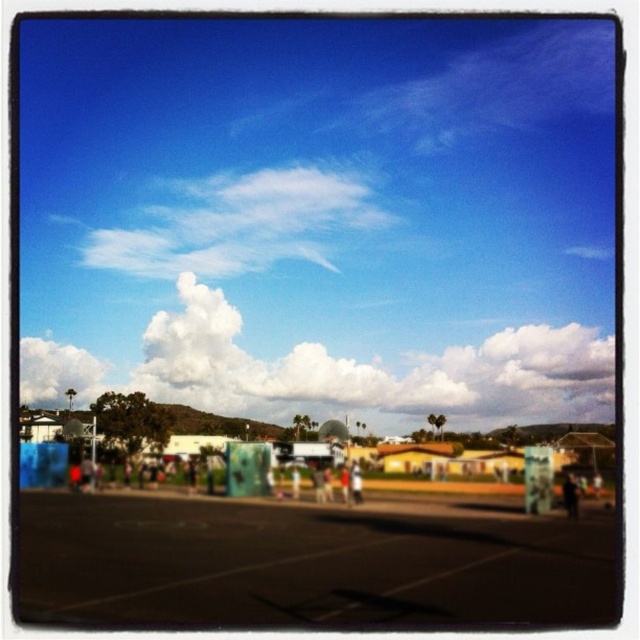
Question: Can you confirm if black asphalt parking lot at lower left is positioned above white fluffy cloud at upper center?

Choices:
 (A) yes
 (B) no

Answer: (B)

Question: Is black asphalt parking lot at lower left positioned before white fluffy cloud at center?

Choices:
 (A) yes
 (B) no

Answer: (A)

Question: In this image, where is black asphalt parking lot at lower left located relative to white fluffy cloud at upper center?

Choices:
 (A) left
 (B) right

Answer: (B)

Question: Which point appears closest to the camera in this image?

Choices:
 (A) (179, 221)
 (B) (58, 365)

Answer: (A)

Question: Among these points, which one is farthest from the camera?

Choices:
 (A) (180, 589)
 (B) (20, 358)
 (C) (358, 198)

Answer: (B)

Question: Which object appears farthest from the camera in this image?

Choices:
 (A) white fluffy cloud at upper left
 (B) white fluffy cloud at upper center
 (C) white fluffy cloud at center
 (D) black asphalt parking lot at lower left

Answer: (B)